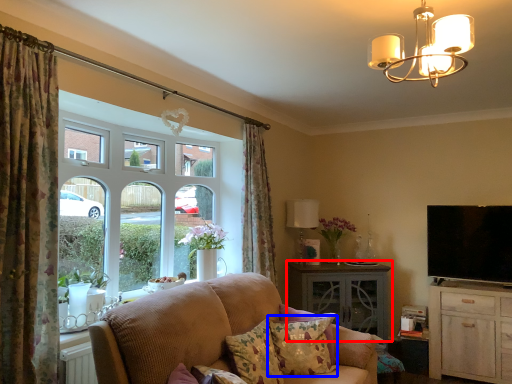
Question: Among these objects, which one is farthest to the camera, table (highlighted by a red box) or pillow (highlighted by a blue box)?

Choices:
 (A) table
 (B) pillow

Answer: (A)